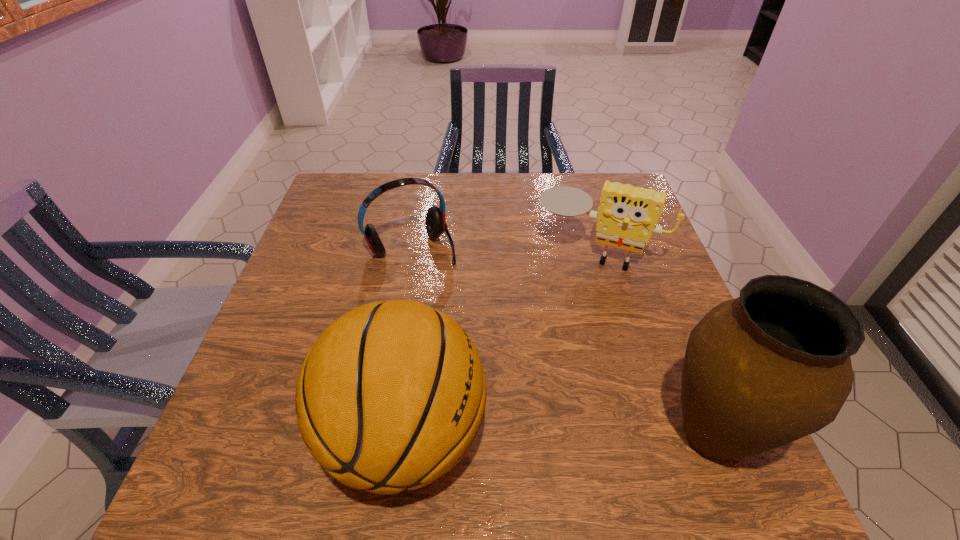
Locate an element on the screen. free area in between the sponge and the headset is located at coordinates (504, 249).

The image size is (960, 540). I want to click on blank region between the basketball and the sponge, so click(500, 343).

Image resolution: width=960 pixels, height=540 pixels. What are the coordinates of `vacant space that's between the headset and the sponge` in the screenshot? It's located at (504, 249).

Find the location of a particular element. the second closest object to the sponge is located at coordinates (391, 396).

Find the location of a particular element. This screenshot has width=960, height=540. object identified as the closest to the basketball is located at coordinates (772, 366).

The width and height of the screenshot is (960, 540). I want to click on vacant point that satisfies the following two spatial constraints: 1. on the front side of the basketball; 2. on the surface of the headset near the brand logo, so click(380, 436).

Locate an element on the screen. vacant position in the image that satisfies the following two spatial constraints: 1. on the front side of the headset; 2. on the surface of the basketball near the brand logo is located at coordinates (380, 436).

Where is `free spot that satisfies the following two spatial constraints: 1. on the front side of the basketball; 2. on the surface of the headset near the brand logo`? The width and height of the screenshot is (960, 540). free spot that satisfies the following two spatial constraints: 1. on the front side of the basketball; 2. on the surface of the headset near the brand logo is located at coordinates (380, 436).